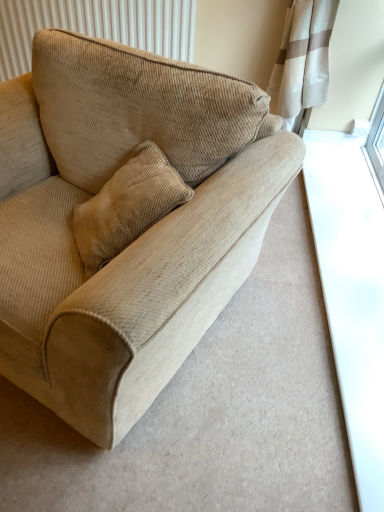
Locate an element on the screen. free spot to the right of beige corduroy couch at center is located at coordinates [x=286, y=344].